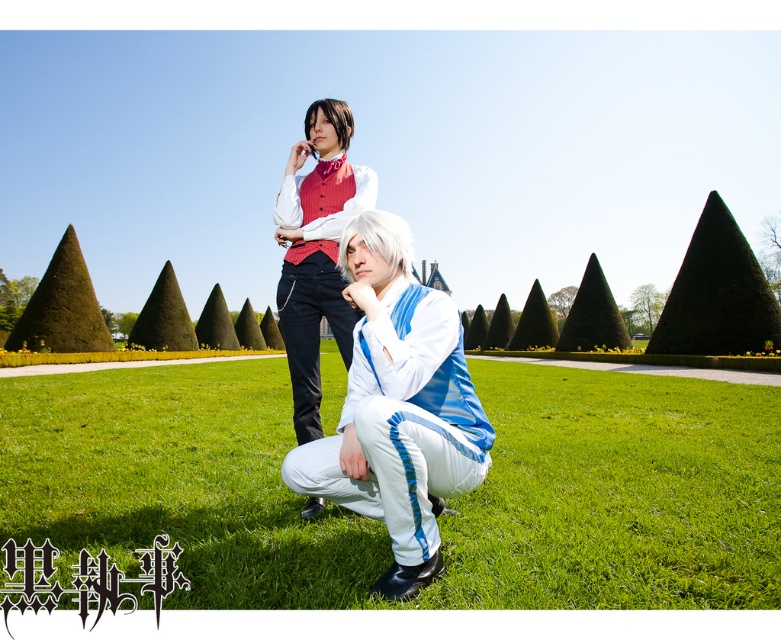
You are planning to stage a small picnic on the green grass at lower center and need to place a picnic basket on the white glossy suit at center. Considering the size of both areas, will the basket fit comfortably without overlapping the edges?

The green grass at lower center is larger in size than the white glossy suit at center. Therefore, the picnic basket may not fit comfortably on the smaller white glossy suit at center without overlapping the edges.

You are a photographer planning to take a picture of the scene. You want to ensure that both the green grass at lower center and the white glossy suit at center are clearly visible in the frame. Based on their positions, which object is closer to the camera and might require adjusting the focus to capture both effectively?

The green grass at lower center is closer to the camera since it is in front of the white glossy suit at center. To capture both clearly, focus on the white glossy suit at center and use a smaller aperture to increase depth of field.

You are a photographer planning to take a portrait of the two people in the image. You want to ensure the white glossy suit at center and the matte red vest at upper center are both clearly visible in the frame. Based on their positions, which one is closer to the camera?

The white glossy suit at center is below the matte red vest at upper center, meaning it is positioned lower in the frame. Since the matte red vest at upper center is higher up, it is likely closer to the camera.